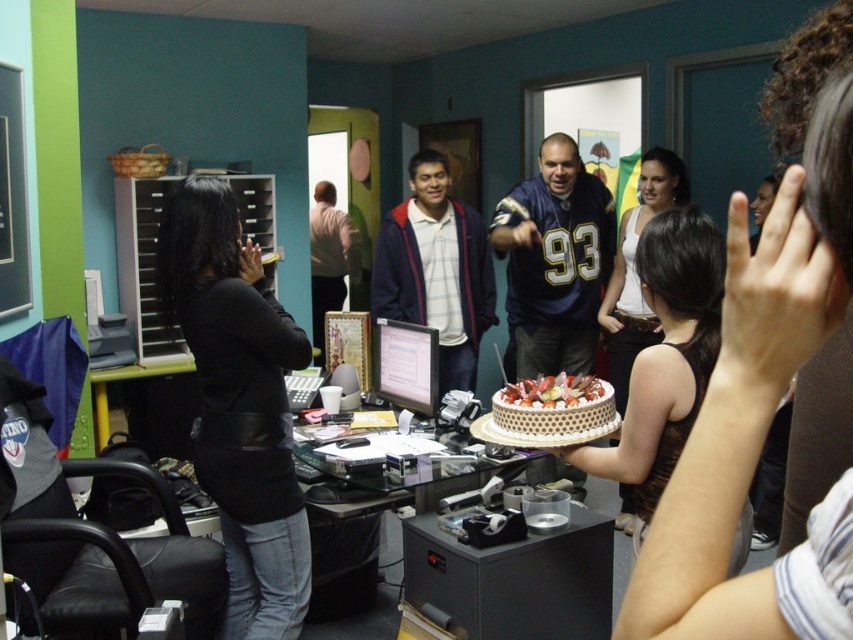
You are attending an office party and want to grab the white textured cake at center to serve yourself a slice. However, there is a black leather jacket at left in your way. Based on their positions, can you reach the cake without moving the jacket?

The black leather jacket at left is positioned on the left side of the white textured cake at center, so you can reach the cake without moving the jacket since it is to the left of the cake and not blocking the path.

You are organizing a surprise party in this office. You need to place a decorative banner between the white textured cake at center and the light brown leather jacket at center. Since the cake is narrower than the jacket, which object should you place the banner closer to to ensure it doesn

The white textured cake at center is narrower than the light brown leather jacket at center. To ensure the banner is centered between them, place it closer to the white textured cake at center since it takes up less space.